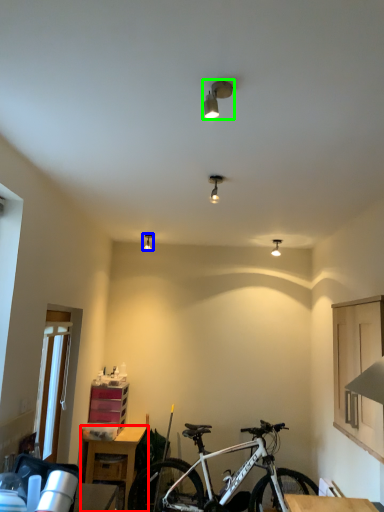
Question: Considering the real-world distances, which object is closest to table (highlighted by a red box)? light fixture (highlighted by a blue box) or light fixture (highlighted by a green box).

Choices:
 (A) light fixture
 (B) light fixture

Answer: (A)